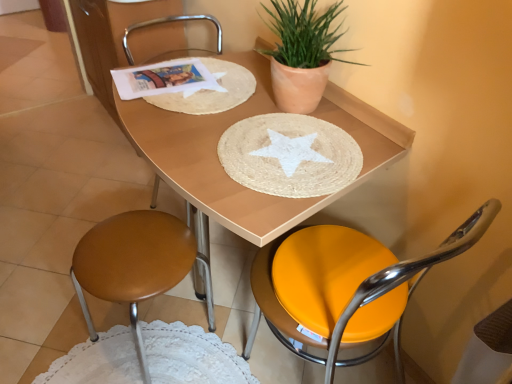
At what (x,y) coordinates should I click in order to perform the action: click on vacant area that lies between terracotta clay pot at upper right and white woven placemat at upper left, the second paper plate when ordered from bottom to top. Please return your answer as a coordinate pair (x, y). This screenshot has width=512, height=384. Looking at the image, I should click on (239, 111).